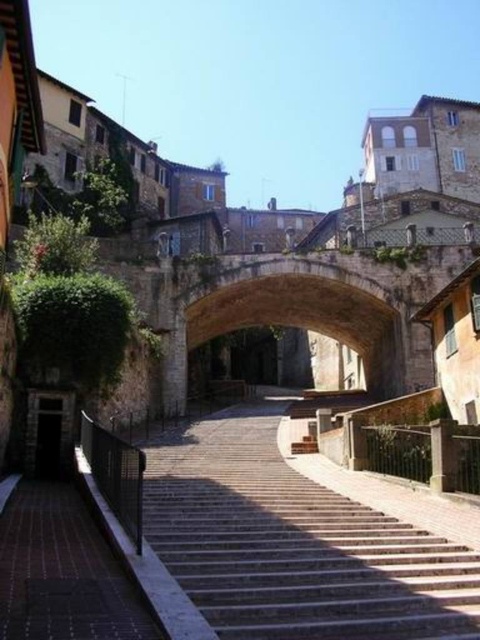
Does smooth stone stairs at center have a lesser width compared to brown stone archway at center?

Indeed, smooth stone stairs at center has a lesser width compared to brown stone archway at center.

Does smooth stone stairs at center have a smaller size compared to brown stone archway at center?

Yes.

Which is in front, point (193, 568) or point (237, 291)?

Positioned in front is point (193, 568).

Find the location of `smooth stone stairs at center`. smooth stone stairs at center is located at coordinates (294, 545).